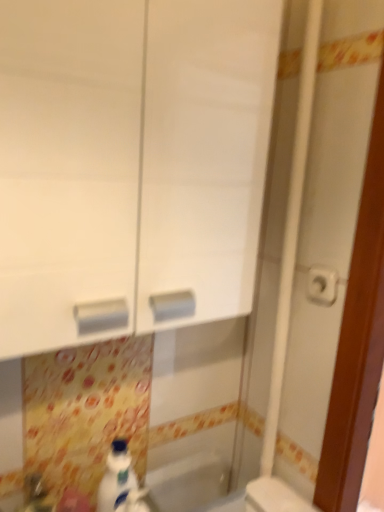
Question: Is white glossy sink at lower left located within white plastic toilet at lower right?

Choices:
 (A) no
 (B) yes

Answer: (A)

Question: Is white plastic toilet at lower right bigger than white glossy sink at lower left?

Choices:
 (A) yes
 (B) no

Answer: (A)

Question: Does white plastic toilet at lower right lie behind white glossy sink at lower left?

Choices:
 (A) no
 (B) yes

Answer: (B)

Question: Does white plastic toilet at lower right appear on the right side of white glossy sink at lower left?

Choices:
 (A) yes
 (B) no

Answer: (A)

Question: Is white plastic toilet at lower right taller than white glossy sink at lower left?

Choices:
 (A) yes
 (B) no

Answer: (A)

Question: Does white plastic toilet at lower right lie in front of white glossy sink at lower left?

Choices:
 (A) no
 (B) yes

Answer: (A)

Question: Is white plastic toilet at lower right not inside white plastic toilet paper at right?

Choices:
 (A) no
 (B) yes

Answer: (B)

Question: Does white plastic toilet at lower right have a larger size compared to white plastic toilet paper at right?

Choices:
 (A) yes
 (B) no

Answer: (A)

Question: Could you tell me if white plastic toilet at lower right is turned towards white plastic toilet paper at right?

Choices:
 (A) yes
 (B) no

Answer: (B)

Question: From the image's perspective, is white plastic toilet at lower right above white plastic toilet paper at right?

Choices:
 (A) no
 (B) yes

Answer: (A)

Question: From the image's perspective, is white plastic toilet at lower right below white plastic toilet paper at right?

Choices:
 (A) yes
 (B) no

Answer: (A)

Question: From a real-world perspective, does white plastic toilet at lower right sit lower than white plastic toilet paper at right?

Choices:
 (A) no
 (B) yes

Answer: (B)

Question: Considering the relative sizes of white glossy bottle at lower center and white glossy cabinet at center in the image provided, is white glossy bottle at lower center thinner than white glossy cabinet at center?

Choices:
 (A) yes
 (B) no

Answer: (A)